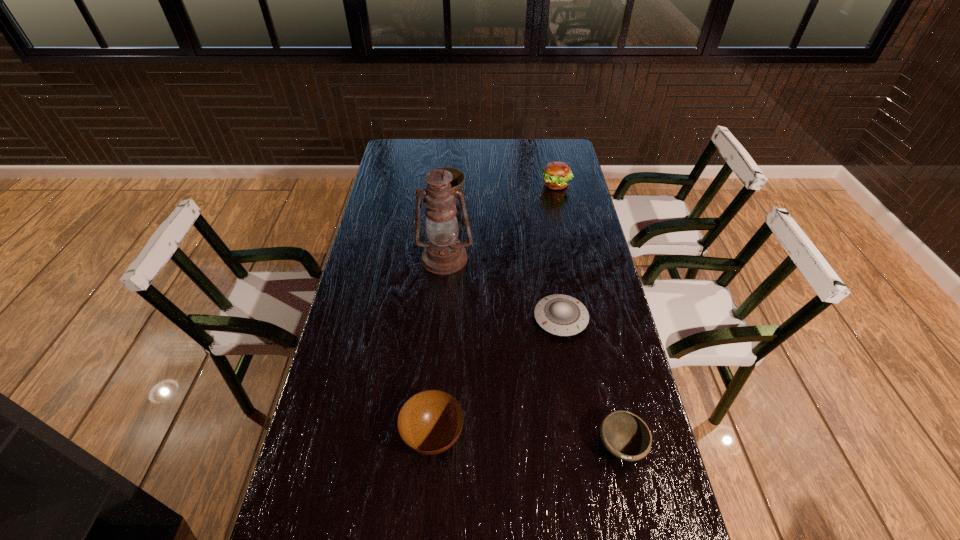
Identify the location of vacant region located 0.330m on the front of the farthest bowl. This screenshot has height=540, width=960. (441, 268).

The height and width of the screenshot is (540, 960). I want to click on vacant region located on the left of the hamburger, so click(x=508, y=185).

Image resolution: width=960 pixels, height=540 pixels. What are the coordinates of `free space located on the back of the second tallest bowl` in the screenshot? It's located at (443, 315).

Where is `free space located 0.340m on the left of the shortest bowl`? This screenshot has height=540, width=960. free space located 0.340m on the left of the shortest bowl is located at coordinates (458, 446).

Where is `free point located 0.290m on the left of the saucer`? This screenshot has width=960, height=540. free point located 0.290m on the left of the saucer is located at coordinates (441, 319).

Identify the location of hamburger present at the right edge. This screenshot has width=960, height=540. (556, 174).

Locate an element on the screen. This screenshot has width=960, height=540. bowl located in the right edge section of the desktop is located at coordinates point(626,436).

At what (x,y) coordinates should I click in order to perform the action: click on saucer located at the right edge. Please return your answer as a coordinate pair (x, y). Looking at the image, I should click on (562, 315).

Where is `vacant space at the far edge of the desktop`? The width and height of the screenshot is (960, 540). vacant space at the far edge of the desktop is located at coordinates (444, 159).

This screenshot has width=960, height=540. I want to click on vacant space at the left edge of the desktop, so click(396, 176).